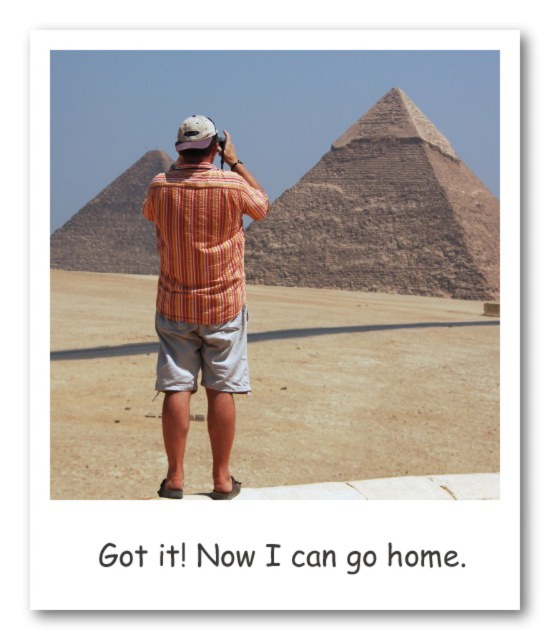
Question: Which point is farther to the camera?

Choices:
 (A) orange striped shirt at center
 (B) brown rough stone pyramid at center
 (C) brown stone pyramid at left

Answer: (C)

Question: Which object is farther from the camera taking this photo?

Choices:
 (A) orange striped shirt at center
 (B) brown rough stone pyramid at center

Answer: (B)

Question: Does brown rough stone pyramid at center have a larger size compared to brown stone pyramid at left?

Choices:
 (A) no
 (B) yes

Answer: (B)

Question: Can you confirm if orange striped shirt at center is wider than brown stone pyramid at left?

Choices:
 (A) yes
 (B) no

Answer: (B)

Question: Which of the following is the farthest from the observer?

Choices:
 (A) (234, 317)
 (B) (310, 280)

Answer: (B)

Question: Is brown rough stone pyramid at center positioned behind brown stone pyramid at left?

Choices:
 (A) no
 (B) yes

Answer: (A)